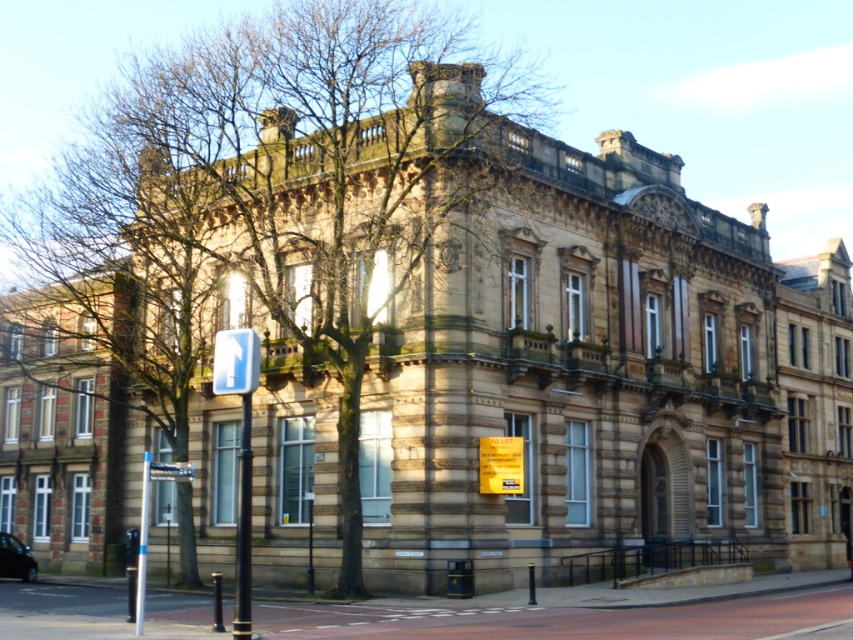
Question: Which object appears farthest from the camera in this image?

Choices:
 (A) white plastic sign at center
 (B) brown textured tree at center
 (C) shiny black car at lower left

Answer: (C)

Question: Which object appears farthest from the camera in this image?

Choices:
 (A) shiny black car at lower left
 (B) brown textured tree at center

Answer: (A)

Question: Is brown textured tree at center closer to camera compared to silver metallic pole at lower left?

Choices:
 (A) no
 (B) yes

Answer: (A)

Question: Where is silver metallic pole at lower left located in relation to white plastic sign at center in the image?

Choices:
 (A) above
 (B) below

Answer: (B)

Question: Does brown textured tree at center appear on the left side of white plastic sign at center?

Choices:
 (A) no
 (B) yes

Answer: (B)

Question: Estimate the real-world distances between objects in this image. Which object is farther from the white plastic sign at center?

Choices:
 (A) brown textured tree at center
 (B) silver metallic pole at lower left
 (C) shiny black car at lower left

Answer: (A)